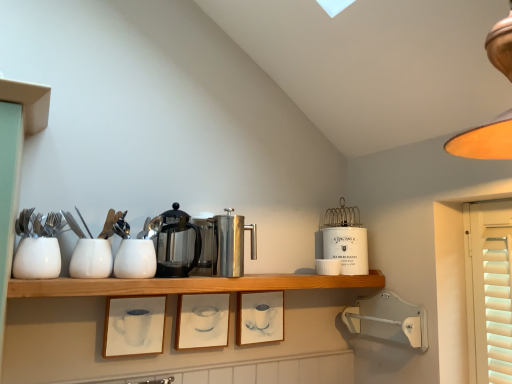
You are a GUI agent. You are given a task and a screenshot of the screen. Output one action in this format:
    pyautogui.click(x=<x>, y=<y>)
    Task: Click on the space that is in front of white glossy teapot at center, the 3th tableware viewed from the left
    
    Given the screenshot: What is the action you would take?
    pyautogui.click(x=106, y=278)